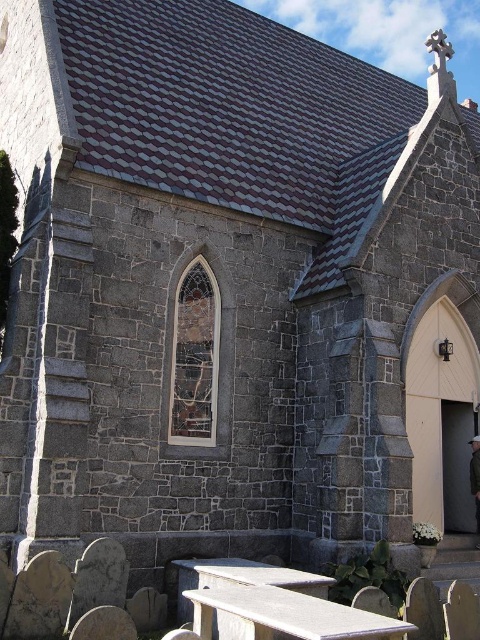
You are visiting the church and need to sit down. You see a smooth gray bench at lower center and a dark brown leather jacket at lower right. Which object is shorter and thus suitable for sitting?

The smooth gray bench at lower center is shorter than the dark brown leather jacket at lower right, so it is suitable for sitting.

You are standing in front of the church and see the smooth gray bench at lower center and the dark brown leather jacket at lower right. Which object is positioned closer to the left side of the scene?

The smooth gray bench at lower center is positioned closer to the left side of the scene compared to the dark brown leather jacket at lower right.

You are visiting the church and want to sit down. You see a smooth gray bench at lower center and a smooth gray picnic table at lower center. Which one has more seating space?

The smooth gray picnic table at lower center has more seating space because it is larger than the smooth gray bench at lower center.